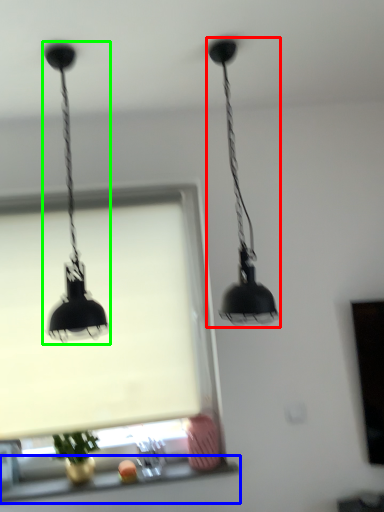
Question: Considering the real-world distances, which object is closest to lamp (highlighted by a red box)? window sill (highlighted by a blue box) or lamp (highlighted by a green box).

Choices:
 (A) window sill
 (B) lamp

Answer: (B)